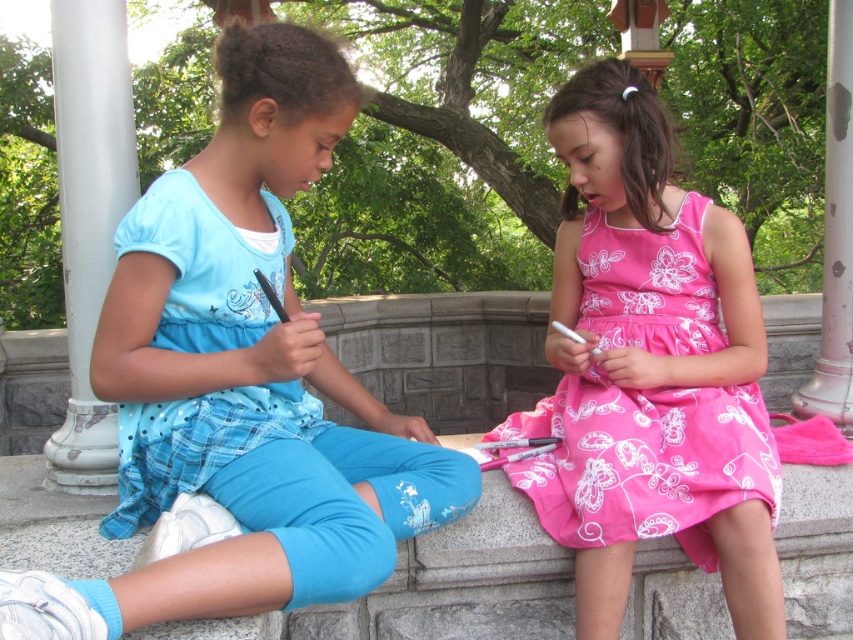
Is matte blue pants at center above pink floral dress at center?

Yes.

Who is lower down, matte blue pants at center or pink floral dress at center?

pink floral dress at center is lower down.

Measure the distance between matte blue pants at center and camera.

matte blue pants at center and camera are 5.26 feet apart from each other.

The height and width of the screenshot is (640, 853). I want to click on matte blue pants at center, so click(242, 378).